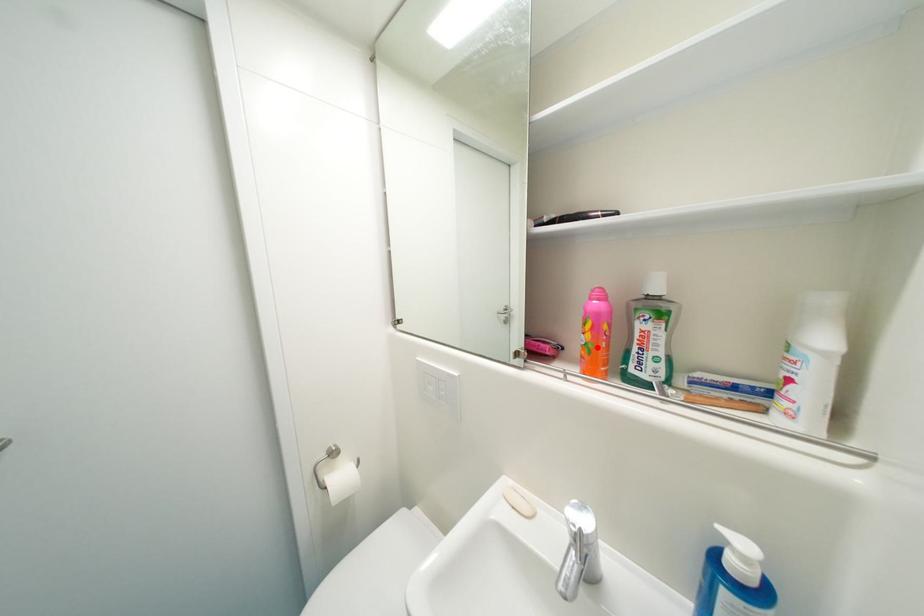
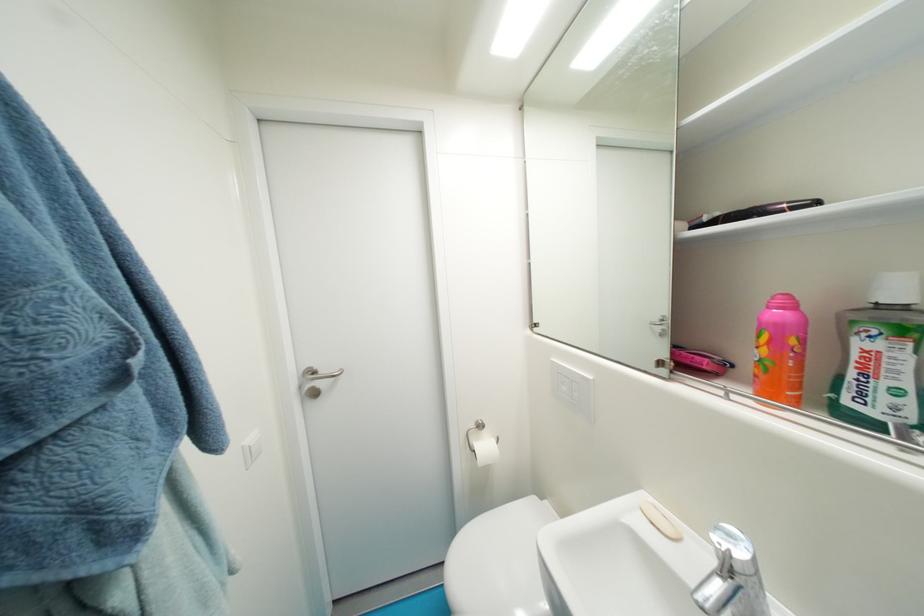
Locate, in the second image, the point that corresponds to the highlighted location in the first image.

(774, 363)